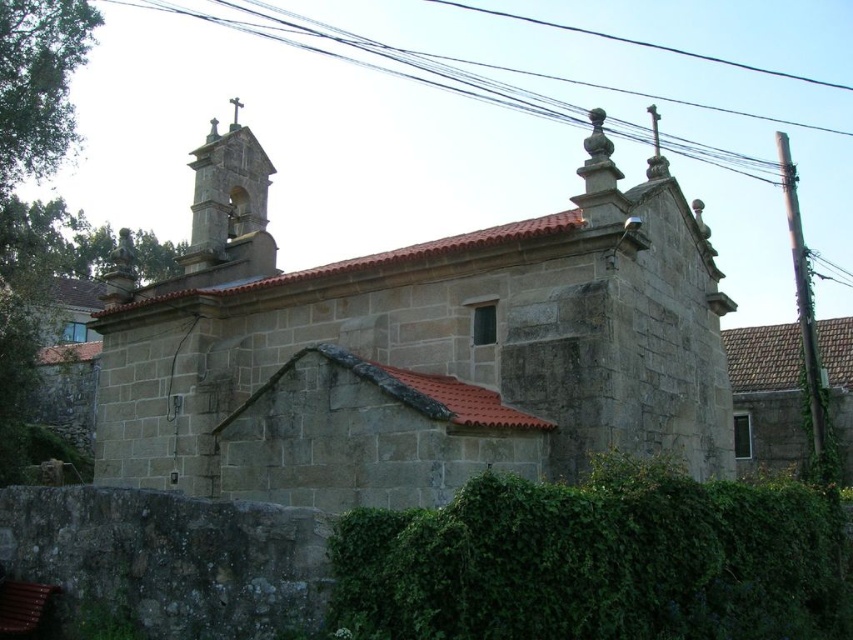
Question: Can you confirm if stone church at center is positioned to the left of green leafy hedge at lower center?

Choices:
 (A) no
 (B) yes

Answer: (B)

Question: Is stone church at center thinner than green leafy hedge at lower center?

Choices:
 (A) no
 (B) yes

Answer: (A)

Question: Which object appears farthest from the camera in this image?

Choices:
 (A) green leafy hedge at lower center
 (B) stone church at center

Answer: (B)

Question: Does stone church at center appear over green leafy hedge at lower center?

Choices:
 (A) no
 (B) yes

Answer: (B)

Question: Which object is closer to the camera taking this photo?

Choices:
 (A) stone church at center
 (B) green leafy hedge at lower center

Answer: (B)

Question: Which object appears farthest from the camera in this image?

Choices:
 (A) stone church at center
 (B) green leafy hedge at lower center

Answer: (A)